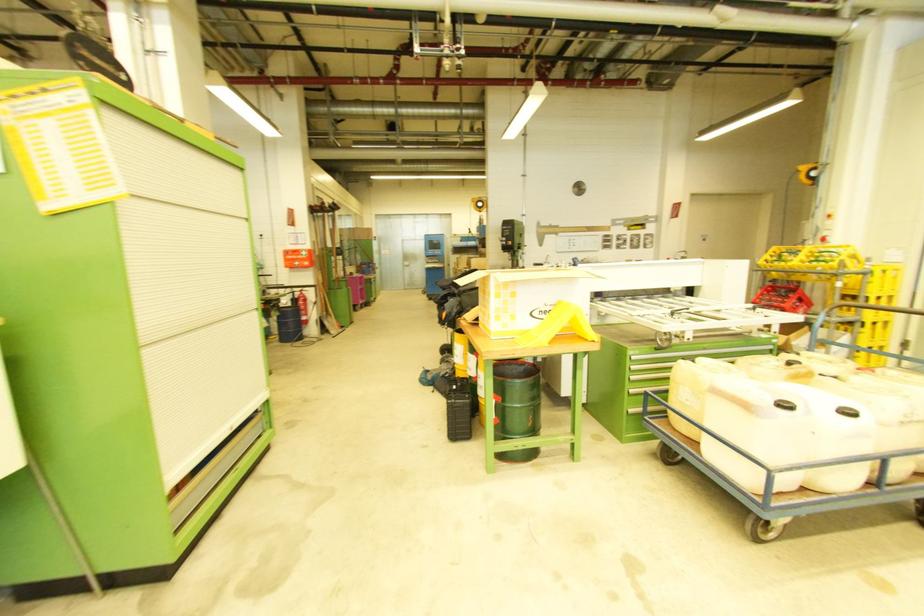
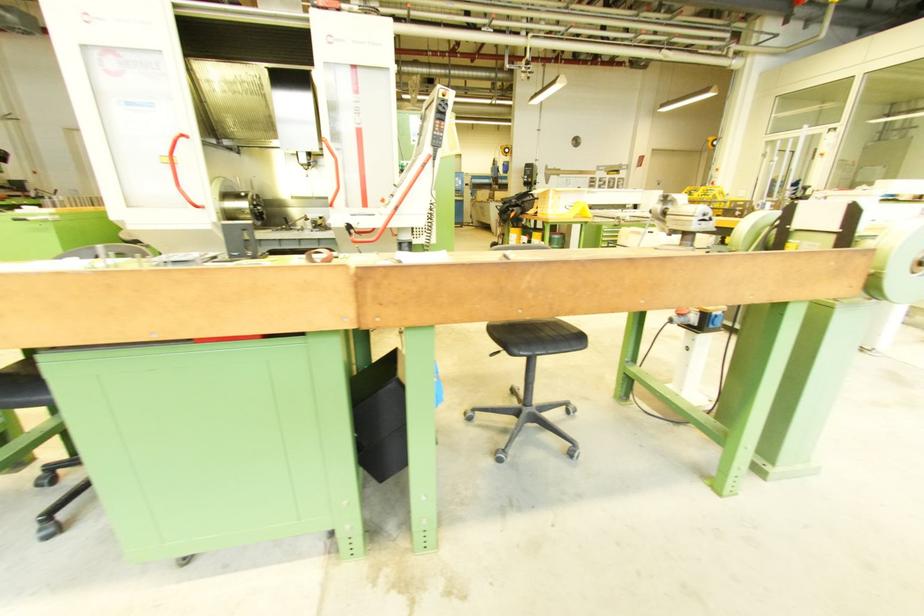
Consider the image. Which direction would the cameraman need to move to produce the second image?

The cameraman moved toward left, backward.